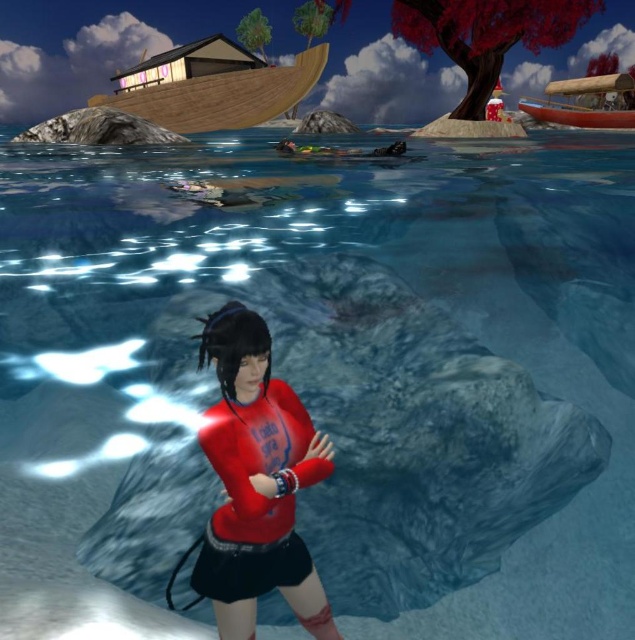
You are a character in the scene and want to reach the wooden boat at upper left and the wooden canoe at upper right. Which one is closer to you?

The wooden boat at upper left is closer to you because it is smaller than the wooden canoe at upper right, indicating it is nearer.

You are a character in the game and want to jump from the rock where you are standing to the nearest point between point (x=224, y=349) and point (x=526, y=108). Which point should you aim for to land safely?

You should aim for point (x=224, y=349) because it is closer to the camera, meaning it is nearer to your current position on the rock, allowing for a safer jump.